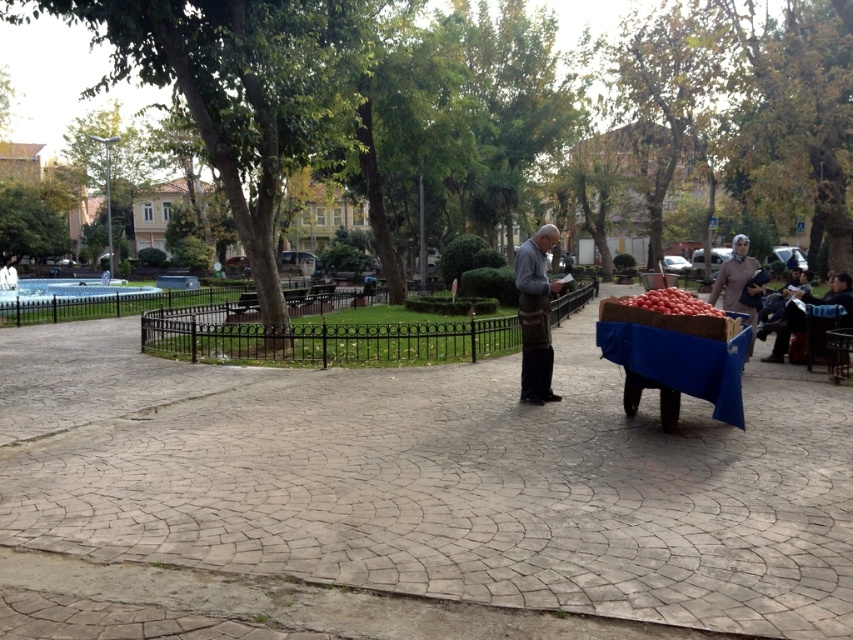
You are a customer at the park and want to buy some tomatoes. You see the brown woolen coat at center and the red matte tomatoes at right. Which item is wider?

The red matte tomatoes at right are wider than the brown woolen coat at center.

You are standing at the position of point (x=672, y=285) and want to walk towards the man near the cart loaded with tomatoes. Will you pass by point (x=660, y=360) on your way?

Yes, because point (x=660, y=360) is in front of point (x=672, y=285), so walking towards the man would require passing through point (x=660, y=360) first.